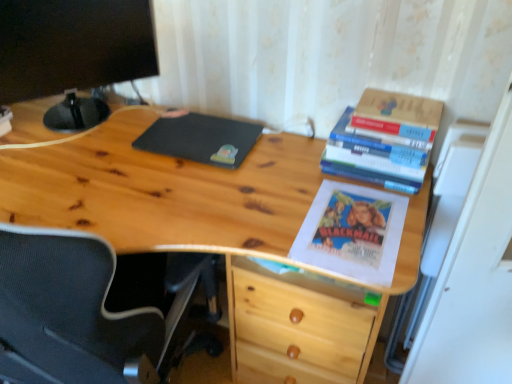
The image size is (512, 384). I want to click on blank space situated above hardcover books at upper right, acting as the 2th book starting from the top (from a real-world perspective), so 382,134.